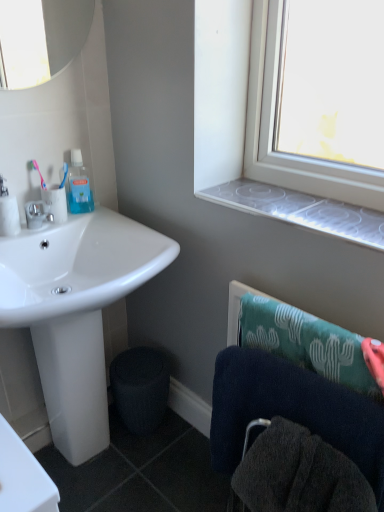
Question: Considering the positions of white glossy sink at lower left and white matte toilet paper at left, the 2th toilet paper from the right, in the image, is white glossy sink at lower left bigger or smaller than white matte toilet paper at left, the 2th toilet paper from the right,?

Choices:
 (A) big
 (B) small

Answer: (A)

Question: Does point (18, 309) appear closer or farther from the camera than point (6, 203)?

Choices:
 (A) closer
 (B) farther

Answer: (A)

Question: Estimate the real-world distances between objects in this image. Which object is closer to the matte silver faucet at left?

Choices:
 (A) dark blue towel at lower right
 (B) transparent plastic window sill at upper right
 (C) pink plastic toothbrush at upper left
 (D) white glossy toilet paper at left, the first toilet paper when ordered from right to left
 (E) white glossy sink at lower left

Answer: (D)

Question: Which is nearer to the pink plastic toothbrush at upper left?

Choices:
 (A) white matte toilet paper at left, the 2th toilet paper from the right
 (B) matte silver faucet at left
 (C) dark blue towel at lower right
 (D) transparent plastic mouthwash at upper left
 (E) transparent plastic window sill at upper right

Answer: (B)